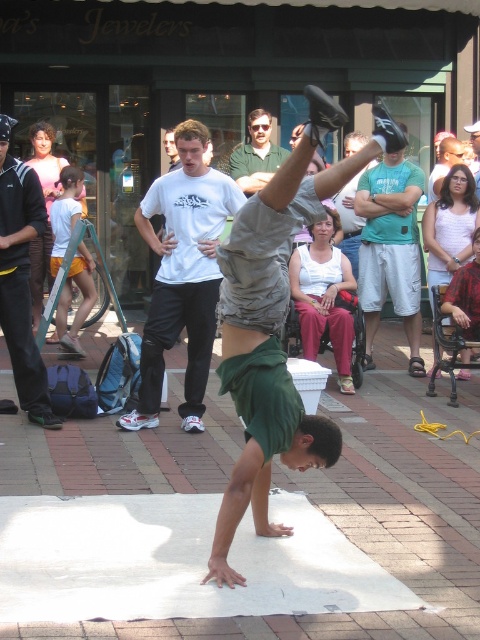
Between white cotton t-shirt at center and white cotton shirt at center, which one appears on the left side from the viewer's perspective?

white cotton t-shirt at center is more to the left.

Can you confirm if white cotton t-shirt at center is taller than white cotton shirt at center?

Indeed, white cotton t-shirt at center has a greater height compared to white cotton shirt at center.

Where is `white cotton t-shirt at center`? This screenshot has width=480, height=640. white cotton t-shirt at center is located at coordinates (182, 275).

Can you confirm if white cotton t-shirt at center is bigger than green shirt at center?

Yes, white cotton t-shirt at center is bigger than green shirt at center.

Is white cotton t-shirt at center behind green shirt at center?

No, it is in front of green shirt at center.

Which is in front, point (194, 280) or point (264, 132)?

Point (194, 280) is more forward.

Where is `white cotton t-shirt at center`? The image size is (480, 640). white cotton t-shirt at center is located at coordinates (182, 275).

Who is lower down, red plaid shirt at center or matte white shirt at center?

Positioned lower is red plaid shirt at center.

Does point (466, 296) lie behind point (451, 138)?

No, (466, 296) is closer to viewer.

At what (x,y) coordinates should I click in order to perform the action: click on red plaid shirt at center. Please return your answer as a coordinate pair (x, y). Looking at the image, I should click on (466, 294).